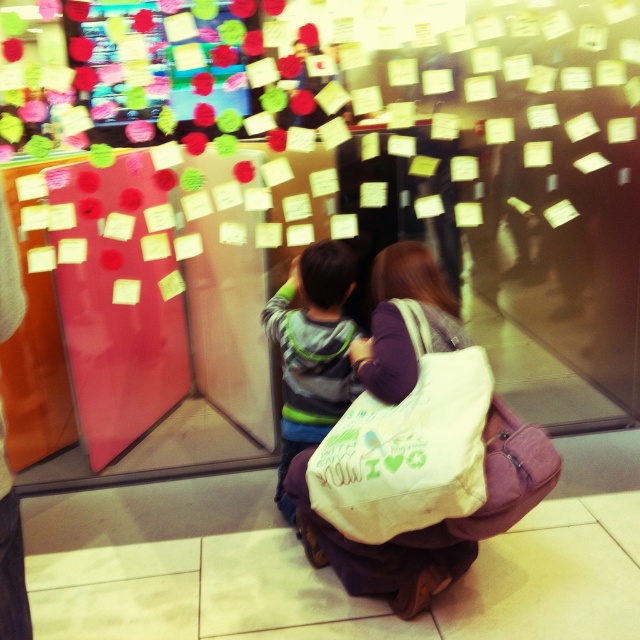
You are a store employee organizing items. You see a customer with a white canvas tote at center and a striped sweater at center. Which item is shorter?

The white canvas tote at center is shorter than the striped sweater at center.

What is the location of the point with coordinates (406,444) in the image?

The point with coordinates (406,444) is located on the white canvas tote at center.

You are standing in the store where the glass display is located. You see the white canvas tote at center and the striped sweater at center. Which item is positioned to the right of the other?

The white canvas tote at center is to the right of the striped sweater at center.